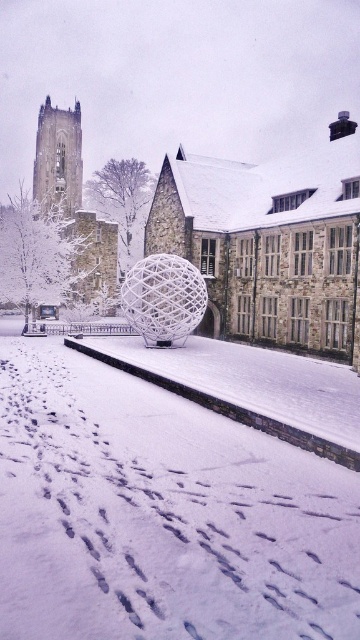
Question: Is white powdery snow at center above white wire mesh sphere at center?

Choices:
 (A) no
 (B) yes

Answer: (A)

Question: Which point is farther to the camera?

Choices:
 (A) white powdery snow at center
 (B) white wire mesh sphere at center
 (C) stone tower at left
 (D) stone tower at upper left

Answer: (D)

Question: In this image, where is white wire mesh sphere at center located relative to stone tower at left?

Choices:
 (A) right
 (B) left

Answer: (A)

Question: Does stone tower at left appear on the left side of stone tower at upper left?

Choices:
 (A) no
 (B) yes

Answer: (A)

Question: Which point appears closest to the camera in this image?

Choices:
 (A) (39, 154)
 (B) (47, 195)

Answer: (B)

Question: Among these points, which one is nearest to the camera?

Choices:
 (A) (1, 472)
 (B) (77, 176)
 (C) (222, 260)
 (D) (73, 166)

Answer: (A)